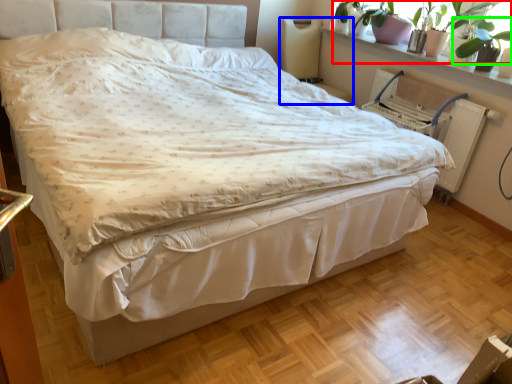
Question: Based on their relative distances, which object is nearer to plant (highlighted by a red box)? Choose from swivel chair (highlighted by a blue box) and plant (highlighted by a green box).

Choices:
 (A) swivel chair
 (B) plant

Answer: (B)